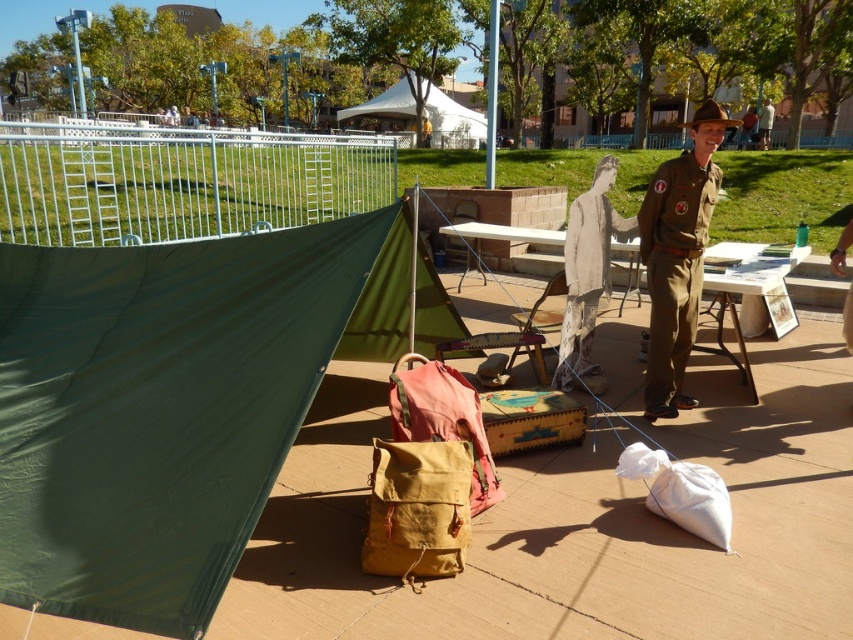
Question: Estimate the real-world distances between objects in this image. Which object is farther from the white paper figure at center?

Choices:
 (A) white canvas tent at upper center
 (B) tan canvas backpack at center

Answer: (A)

Question: Estimate the real-world distances between objects in this image. Which object is closer to the tan canvas backpack at center?

Choices:
 (A) brown canvas backpack at center
 (B) brown leather hat at upper center
 (C) green canvas tent at left

Answer: (A)

Question: Can you confirm if tan canvas backpack at center is thinner than brown leather hat at upper center?

Choices:
 (A) yes
 (B) no

Answer: (A)

Question: Does wooden picnic table at center have a lesser width compared to white canvas tent at upper center?

Choices:
 (A) yes
 (B) no

Answer: (A)

Question: Which of the following is the closest to the observer?

Choices:
 (A) white canvas tent at upper center
 (B) brown uniform at center
 (C) brown canvas backpack at center
 (D) brown leather hat at upper center

Answer: (C)

Question: Does tan canvas backpack at center appear on the left side of white paper figure at center?

Choices:
 (A) yes
 (B) no

Answer: (A)